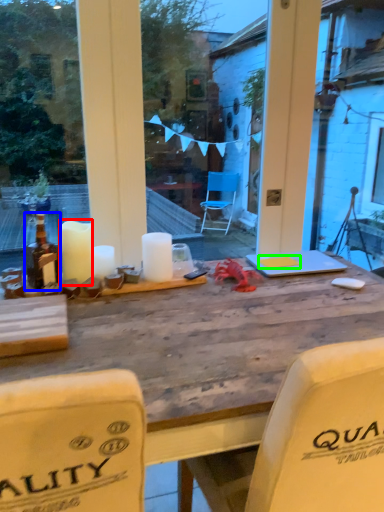
Question: Which object is positioned closest to candle (highlighted by a red box)? Select from bottle (highlighted by a blue box) and notepad (highlighted by a green box).

Choices:
 (A) bottle
 (B) notepad

Answer: (A)